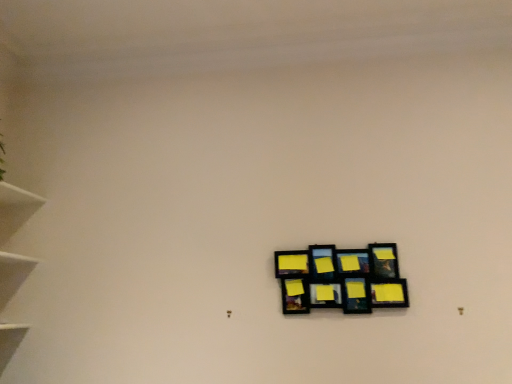
Question: Should I look upward or downward to see black matte picture frame at center?

Choices:
 (A) up
 (B) down

Answer: (B)